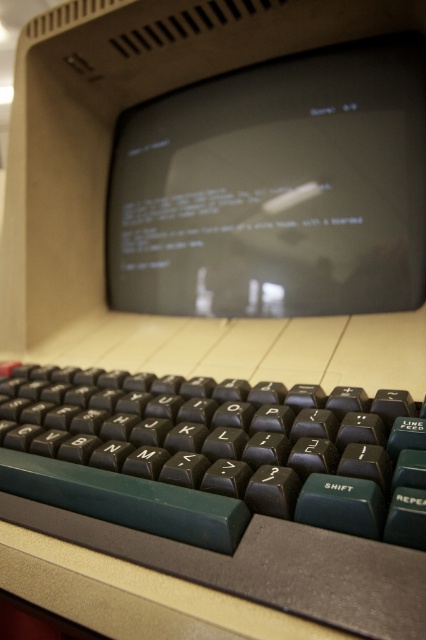
Question: Can you confirm if black plastic keyboard at lower center is thinner than matte black monitor at center?

Choices:
 (A) no
 (B) yes

Answer: (B)

Question: Which point appears closest to the camera in this image?

Choices:
 (A) [x=273, y=173]
 (B) [x=330, y=420]

Answer: (B)

Question: Which object is closer to the camera taking this photo?

Choices:
 (A) matte black monitor at center
 (B) black plastic keyboard at lower center

Answer: (B)

Question: In this image, where is black plastic keyboard at lower center located relative to matte black monitor at center?

Choices:
 (A) left
 (B) right

Answer: (A)

Question: Can you confirm if black plastic keyboard at lower center is smaller than matte black monitor at center?

Choices:
 (A) yes
 (B) no

Answer: (A)